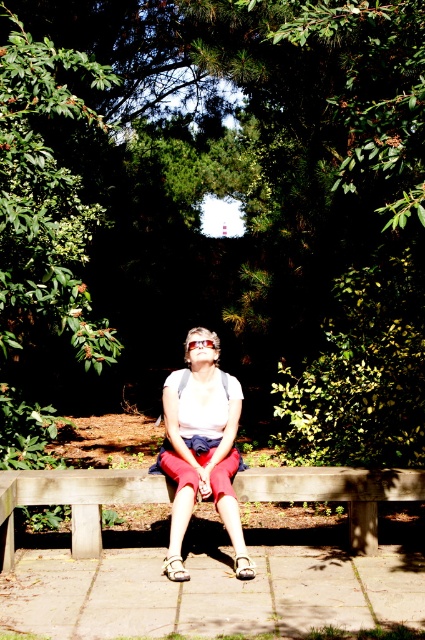
Can you confirm if green leafy tree at center is positioned to the left of matte white shirt at center?

Indeed, green leafy tree at center is positioned on the left side of matte white shirt at center.

Can you confirm if green leafy tree at center is shorter than matte white shirt at center?

Incorrect, green leafy tree at center's height does not fall short of matte white shirt at center's.

The height and width of the screenshot is (640, 425). What do you see at coordinates (220, 196) in the screenshot?
I see `green leafy tree at center` at bounding box center [220, 196].

Find the location of a particular element. This screenshot has width=425, height=640. green leafy tree at center is located at coordinates (220, 196).

Measure the distance from matte white shirt at center to transparent plastic goggles at center.

A distance of 28.10 inches exists between matte white shirt at center and transparent plastic goggles at center.

Can you confirm if matte white shirt at center is smaller than transparent plastic goggles at center?

Incorrect, matte white shirt at center is not smaller in size than transparent plastic goggles at center.

The width and height of the screenshot is (425, 640). What are the coordinates of `matte white shirt at center` in the screenshot? It's located at (201, 449).

Between wooden bench at center and matte white shirt at center, which one appears on the left side from the viewer's perspective?

From the viewer's perspective, wooden bench at center appears more on the left side.

Is wooden bench at center thinner than matte white shirt at center?

No.

Which is behind, point (88, 518) or point (226, 502)?

The point (88, 518) is more distant.

Find the location of `wooden bench at center`. wooden bench at center is located at coordinates (76, 500).